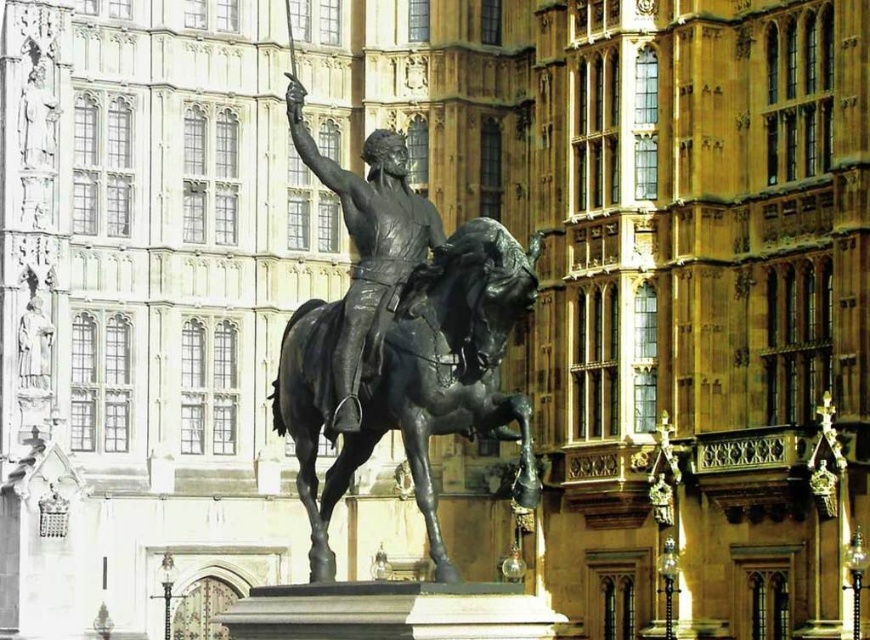
Question: Is polished bronze horse at center above polished bronze statue at center?

Choices:
 (A) no
 (B) yes

Answer: (A)

Question: Does polished bronze horse at center appear under polished bronze statue at center?

Choices:
 (A) yes
 (B) no

Answer: (A)

Question: Does polished bronze horse at center have a greater width compared to polished bronze statue at center?

Choices:
 (A) no
 (B) yes

Answer: (B)